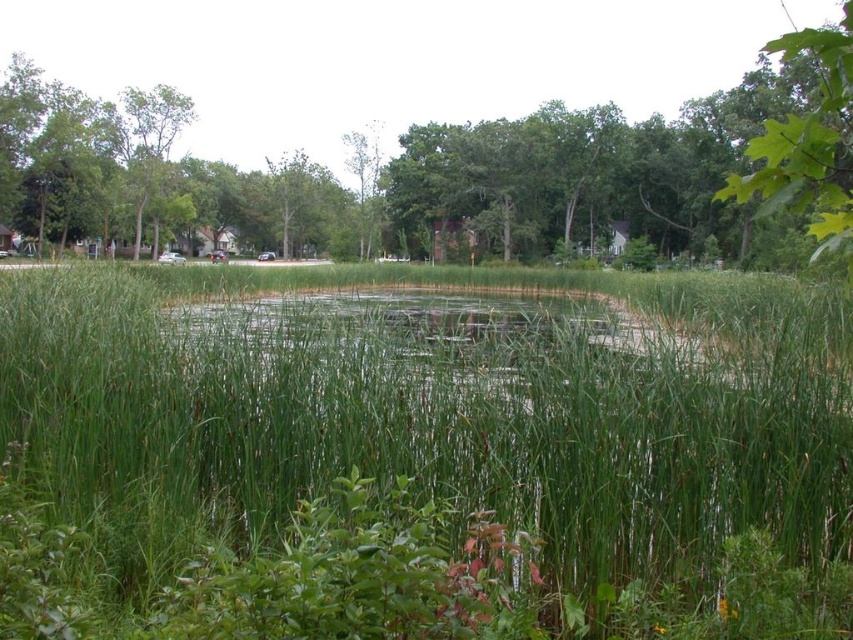
You are a gardener who wants to plant a new row of shrubs between the green grass at center and the green leafy tree at center. Based on their widths, which one should you place closer to the shrubs to ensure they have enough space to grow?

Since the green grass at center is narrower than the green leafy tree at center, you should place the shrubs closer to the green grass at center to allow sufficient space for growth.